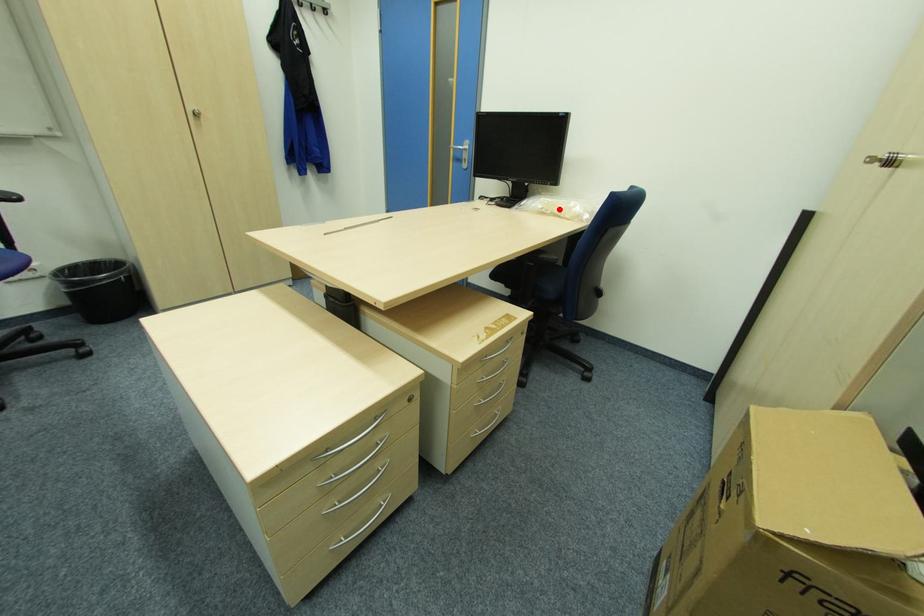
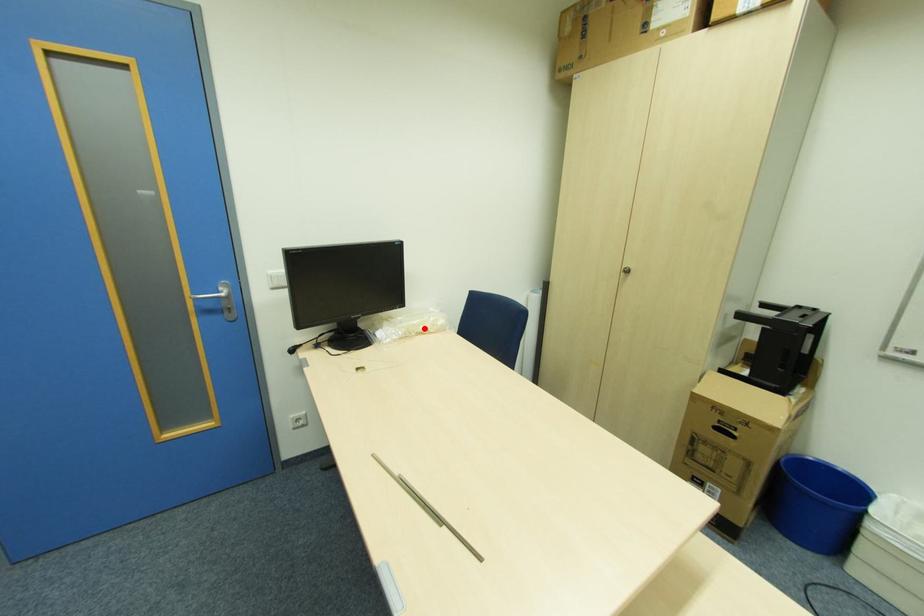
I am providing you with two images of the same scene from different viewpoints. A red point is marked on the first image and another point is marked on the second image. Is the marked point in image1 the same physical position as the marked point in image2?

Yes